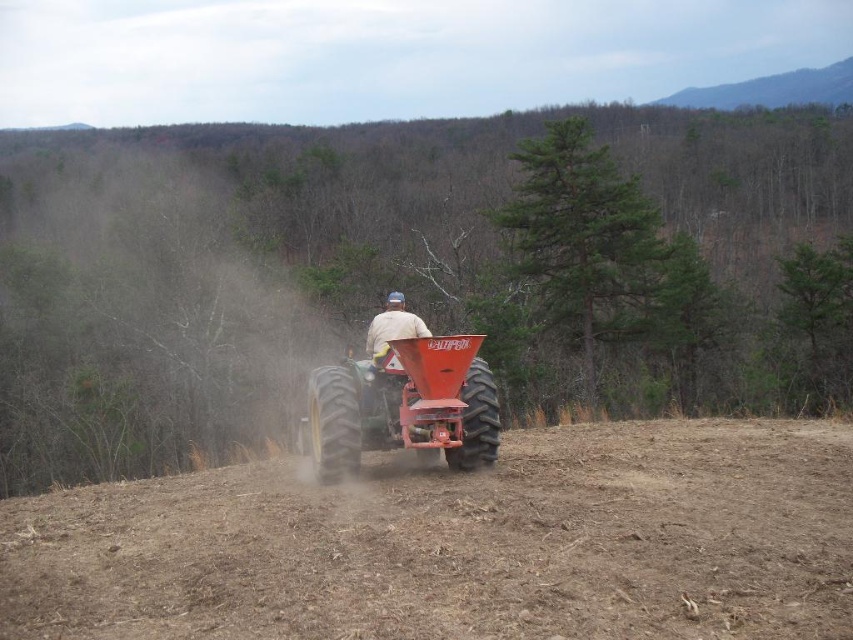
You are a farmer checking the condition of your field. You notice the brown soil at center and the green rubber tractor at center. Which object has a smaller width?

The brown soil at center is thinner than the green rubber tractor at center, so the brown soil at center has a smaller width.